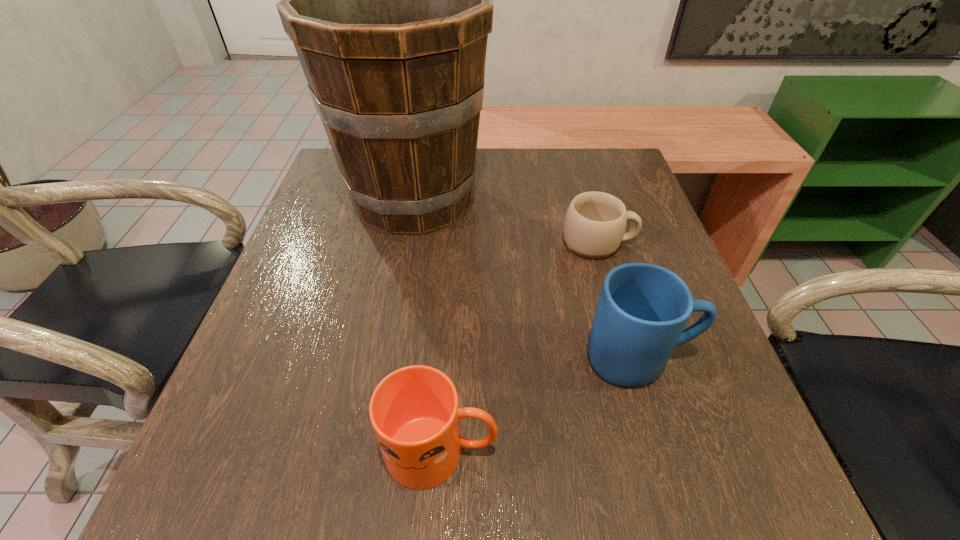
This screenshot has height=540, width=960. Identify the location of object positioned at the near edge. (414, 411).

Image resolution: width=960 pixels, height=540 pixels. I want to click on object positioned at the left edge, so click(388, 0).

I want to click on object that is at the far left corner, so click(388, 0).

In the image, there is a desktop. Where is `blank space at the far edge`? The height and width of the screenshot is (540, 960). blank space at the far edge is located at coordinates (506, 159).

Where is `vacant position at the near edge of the desktop`? The image size is (960, 540). vacant position at the near edge of the desktop is located at coordinates (584, 518).

In order to click on blank space at the left edge in this screenshot , I will do `click(315, 357)`.

In the image, there is a desktop. At what (x,y) coordinates should I click in order to perform the action: click on vacant space at the right edge. Please return your answer as a coordinate pair (x, y). The height and width of the screenshot is (540, 960). Looking at the image, I should click on (629, 205).

In the image, there is a desktop. Where is `free space at the near left corner`? free space at the near left corner is located at coordinates (273, 470).

The height and width of the screenshot is (540, 960). What are the coordinates of `free space between the second shortest mug and the shortest object` in the screenshot? It's located at (519, 347).

Locate an element on the screen. Image resolution: width=960 pixels, height=540 pixels. free space that is in between the shortest object and the nearest object is located at coordinates (519, 347).